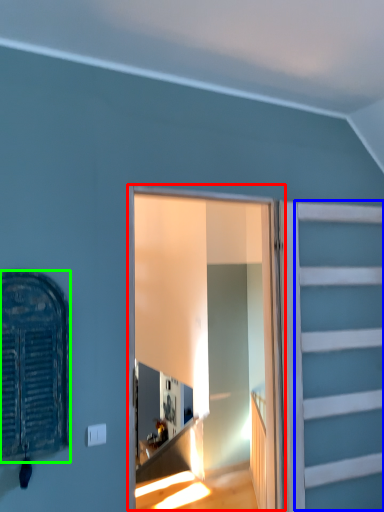
Question: Which object is positioned closest to window frame (highlighted by a red box)? Select from garage door (highlighted by a blue box) and window (highlighted by a green box).

Choices:
 (A) garage door
 (B) window

Answer: (A)